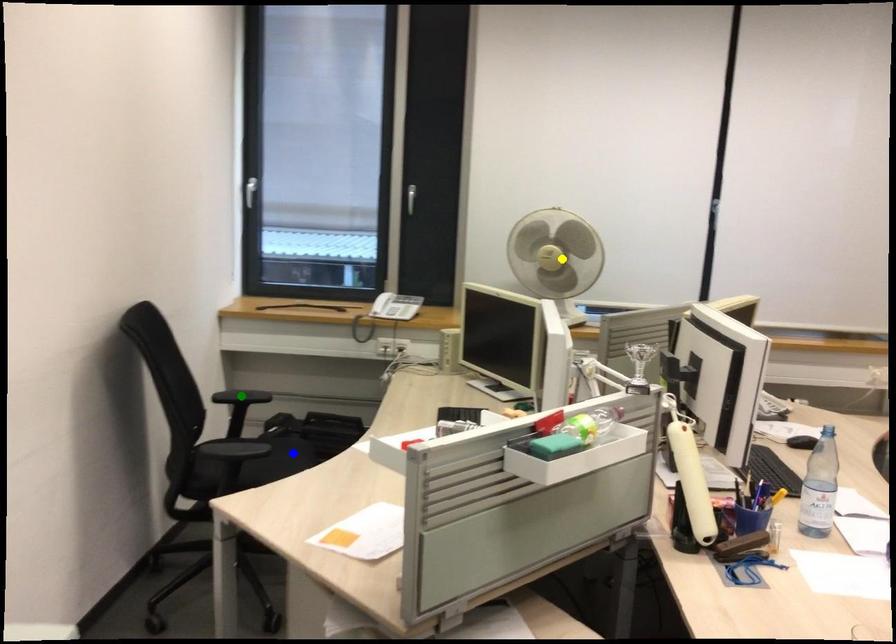
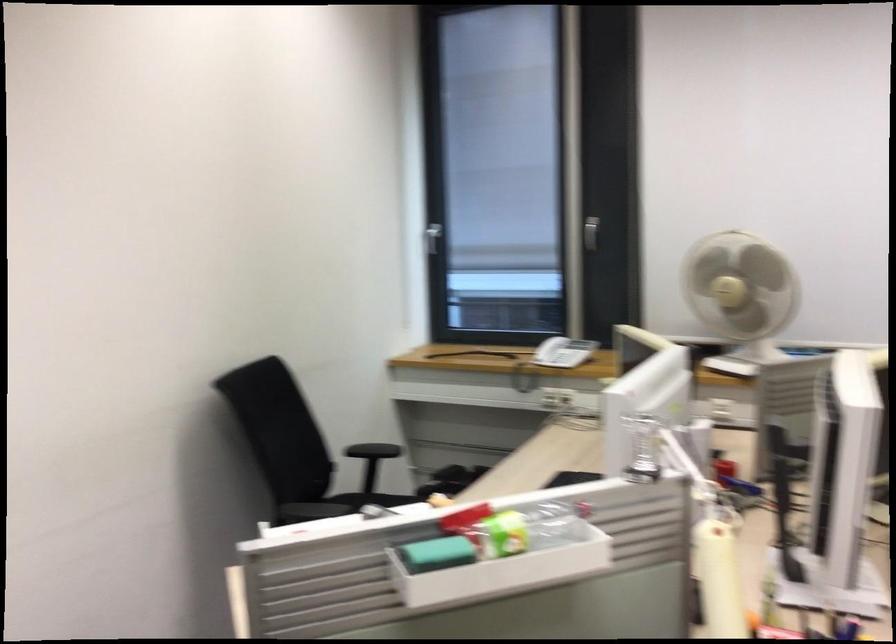
I am providing you with two images of the same scene from different viewpoints. Three points are marked in image1. Which point corresponds to a part or object that is occluded in image2?In image1, three points are marked. Which of them correspond to a part or object that is occluded in image2?Among the three points shown in image1, which one corresponds to a part or object that is no longer visible due to occlusion in image2?

blue point, green point cannot be seen in image2.